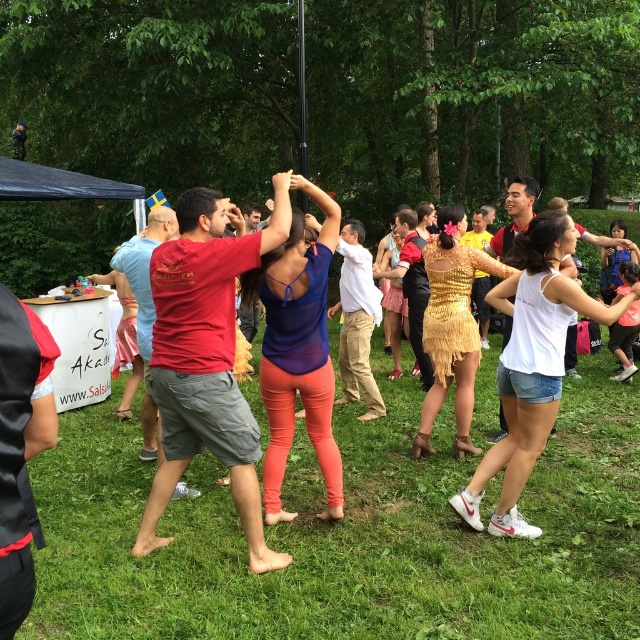
Does green grass at center have a lesser width compared to matte red t-shirt at center?

Yes.

Is green grass at center closer to the viewer compared to matte red t-shirt at center?

No, it is not.

Locate an element on the screen. green grass at center is located at coordinates (348, 536).

Where is `green grass at center`? green grass at center is located at coordinates (348, 536).

Is point (172, 276) farther from camera compared to point (518, 220)?

No, (172, 276) is in front of (518, 220).

Is matte red t-shirt at center bigger than white matte tank top at center?

Correct, matte red t-shirt at center is larger in size than white matte tank top at center.

Does point (241, 500) lie in front of point (515, 205)?

Yes.

You are a GUI agent. You are given a task and a screenshot of the screen. Output one action in this format:
    pyautogui.click(x=<x>, y=<y>)
    Task: Click on the matte red t-shirt at center
    The width and height of the screenshot is (640, 640).
    Given the screenshot: What is the action you would take?
    pyautogui.click(x=205, y=356)

Is green grass at center bigger than white matte tank top at center?

No, green grass at center is not bigger than white matte tank top at center.

Is green grass at center positioned in front of white matte tank top at center?

Yes, green grass at center is in front of white matte tank top at center.

At what (x,y) coordinates should I click in order to perform the action: click on green grass at center. Please return your answer as a coordinate pair (x, y). This screenshot has height=640, width=640. Looking at the image, I should click on (348, 536).

Where is `green grass at center`? The height and width of the screenshot is (640, 640). green grass at center is located at coordinates (348, 536).